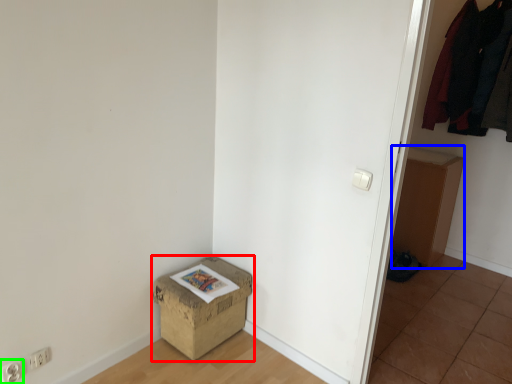
Question: Which is nearer to the box (highlighted by a red box)? cardboard box (highlighted by a blue box) or electric outlet (highlighted by a green box).

Choices:
 (A) cardboard box
 (B) electric outlet

Answer: (B)